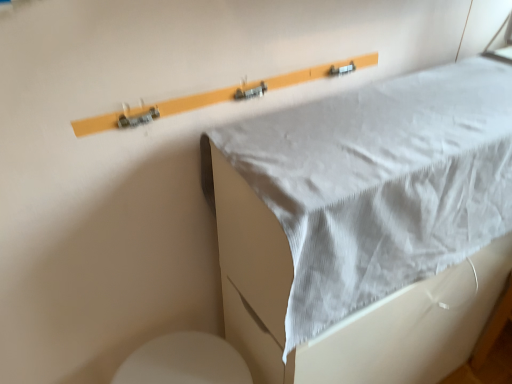
The image size is (512, 384). What are the coordinates of `vacant space situated above white fabric at upper center (from a real-world perspective)` in the screenshot? It's located at (385, 123).